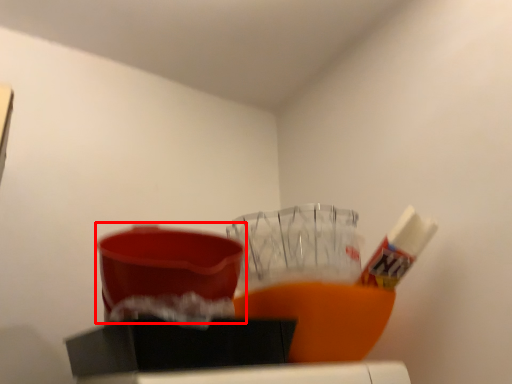
Question: From the image's perspective, what is the correct spatial relationship of basin (annotated by the red box) in relation to toothpaste?

Choices:
 (A) below
 (B) above

Answer: (B)